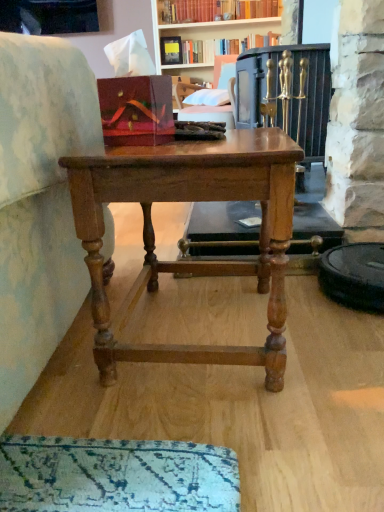
Where is `hardcover book at upper center`? hardcover book at upper center is located at coordinates (222, 47).

Describe the element at coordinates (214, 96) in the screenshot. I see `velvet pink cushion at upper center` at that location.

Locate an element on the screen. wooden table at center is located at coordinates (190, 261).

Which of these two, velvet pink cushion at upper center or hardcover book at upper center, is smaller?

With smaller size is hardcover book at upper center.

Measure the distance from velvet pink cushion at upper center to hardcover book at upper center.

A distance of 20.86 inches exists between velvet pink cushion at upper center and hardcover book at upper center.

Considering the positions of point (224, 103) and point (257, 40), is point (224, 103) closer or farther from the camera than point (257, 40)?

Point (224, 103) is positioned closer to the camera compared to point (257, 40).

From the image's perspective, which one is positioned higher, velvet pink cushion at upper center or hardcover book at upper center?

hardcover book at upper center is shown above in the image.

Is hardcover book at upper center taller or shorter than velvet pink cushion at upper center?

hardcover book at upper center is shorter than velvet pink cushion at upper center.

Can you confirm if hardcover book at upper center is positioned to the right of velvet pink cushion at upper center?

Correct, you'll find hardcover book at upper center to the right of velvet pink cushion at upper center.

How far apart are hardcover book at upper center and velvet pink cushion at upper center?

hardcover book at upper center and velvet pink cushion at upper center are 20.86 inches apart from each other.

From the image's perspective, is hardcover book at upper center located beneath velvet pink cushion at upper center?

Incorrect, from the image's perspective, hardcover book at upper center is higher than velvet pink cushion at upper center.

Is wooden table at center located within velvet pink cushion at upper center?

No.

Between velvet pink cushion at upper center and wooden table at center, which one has more height?

wooden table at center.

From the image's perspective, between velvet pink cushion at upper center and wooden table at center, who is located below?

wooden table at center.

Does wooden table at center have a lesser width compared to hardcover book at upper center?

In fact, wooden table at center might be wider than hardcover book at upper center.

Are wooden table at center and hardcover book at upper center far apart?

Yes.

From a real-world perspective, which object rests below the other?

wooden table at center.

From a real-world perspective, which is physically above, wooden table at center or velvet pink cushion at upper center?

From a 3D spatial view, velvet pink cushion at upper center is above.

Is velvet pink cushion at upper center at the back of wooden table at center?

No, wooden table at center is not facing the opposite direction of velvet pink cushion at upper center.

Is wooden table at center to the left of velvet pink cushion at upper center from the viewer's perspective?

Correct, you'll find wooden table at center to the left of velvet pink cushion at upper center.

Does hardcover book at upper center have a greater height compared to wooden table at center?

In fact, hardcover book at upper center may be shorter than wooden table at center.

From the image's perspective, would you say hardcover book at upper center is positioned over wooden table at center?

Yes.

I want to click on desk that appears below the hardcover book at upper center (from the image's perspective), so click(x=190, y=261).

Image resolution: width=384 pixels, height=512 pixels. I want to click on book above the velvet pink cushion at upper center (from a real-world perspective), so click(x=222, y=47).

Find the location of a particular element. This screenshot has height=512, width=384. swivel chair in front of the hardcover book at upper center is located at coordinates (214, 96).

Estimate the real-world distances between objects in this image. Which object is closer to velvet pink cushion at upper center, hardcover book at upper center or wooden table at center?

hardcover book at upper center is closer to velvet pink cushion at upper center.

Considering their positions, is velvet pink cushion at upper center positioned closer to wooden table at center than hardcover book at upper center?

velvet pink cushion at upper center.

Considering their positions, is velvet pink cushion at upper center positioned further to hardcover book at upper center than wooden table at center?

Based on the image, wooden table at center appears to be further to hardcover book at upper center.

Considering their positions, is hardcover book at upper center positioned closer to wooden table at center than velvet pink cushion at upper center?

velvet pink cushion at upper center lies closer to wooden table at center than the other object.

Which object lies nearer to the anchor point velvet pink cushion at upper center, wooden table at center or hardcover book at upper center?

The object closer to velvet pink cushion at upper center is hardcover book at upper center.

Considering their positions, is wooden table at center positioned further to hardcover book at upper center than velvet pink cushion at upper center?

The object further to hardcover book at upper center is wooden table at center.

At what (x,y) coordinates should I click in order to perform the action: click on swivel chair between wooden table at center and hardcover book at upper center along the z-axis. Please return your answer as a coordinate pair (x, y). The width and height of the screenshot is (384, 512). Looking at the image, I should click on (214, 96).